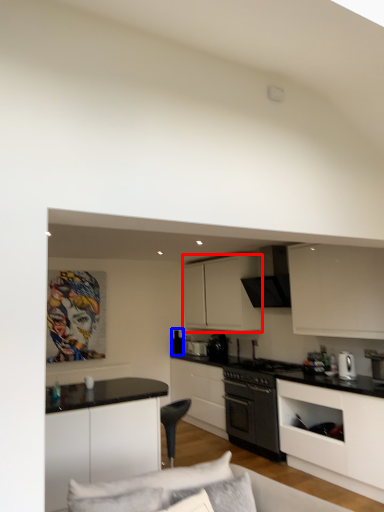
Question: Which object appears closest to the camera in this image, cabinetry (highlighted by a red box) or appliance (highlighted by a blue box)?

Choices:
 (A) cabinetry
 (B) appliance

Answer: (A)